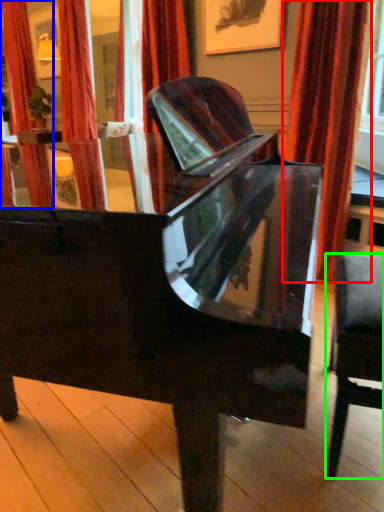
Question: Which object is positioned farthest from curtain (highlighted by a red box)? Select from curtain (highlighted by a blue box) and chair (highlighted by a green box).

Choices:
 (A) curtain
 (B) chair

Answer: (A)